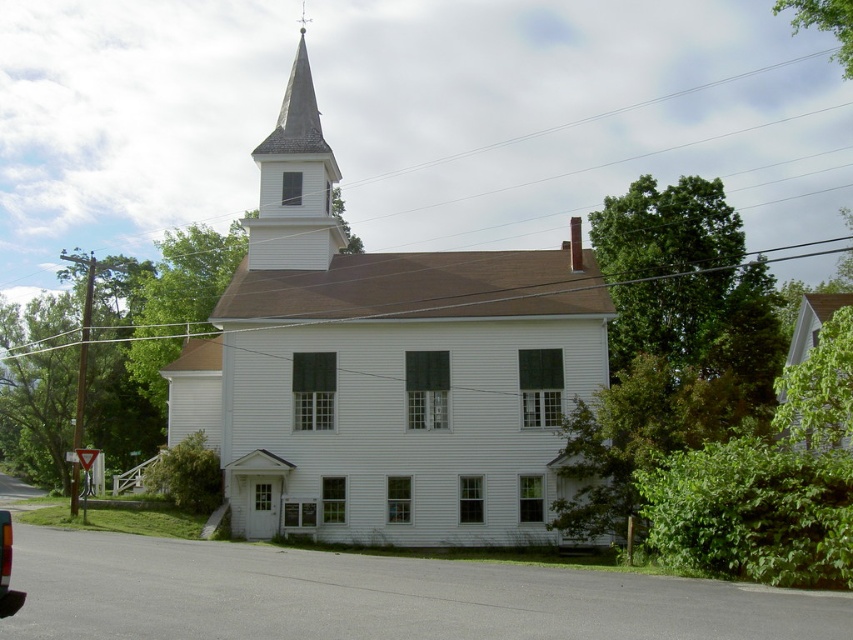
You are driving a car and notice the white wood church at center and the metallic red taillight at lower left in your view. Based on their apparent sizes, which object do you think is farther away from you?

The metallic red taillight at lower left is closer because it appears smaller than the white wood church at center, which might be wider, suggesting it could be farther away but larger in actual size. However, since the taillight is part of a vehicle on the road near the foreground, it is more likely closer despite its smaller appearance.

You are a photographer planning to capture the white wood church at center and the green leafy tree at upper right in a single frame. Based on their sizes, which one would you position closer to the center of the photo to ensure both are clearly visible?

The white wood church at center is wider than the green leafy tree at upper right, so positioning the church closer to the center ensures both are clearly visible while accommodating their size difference.